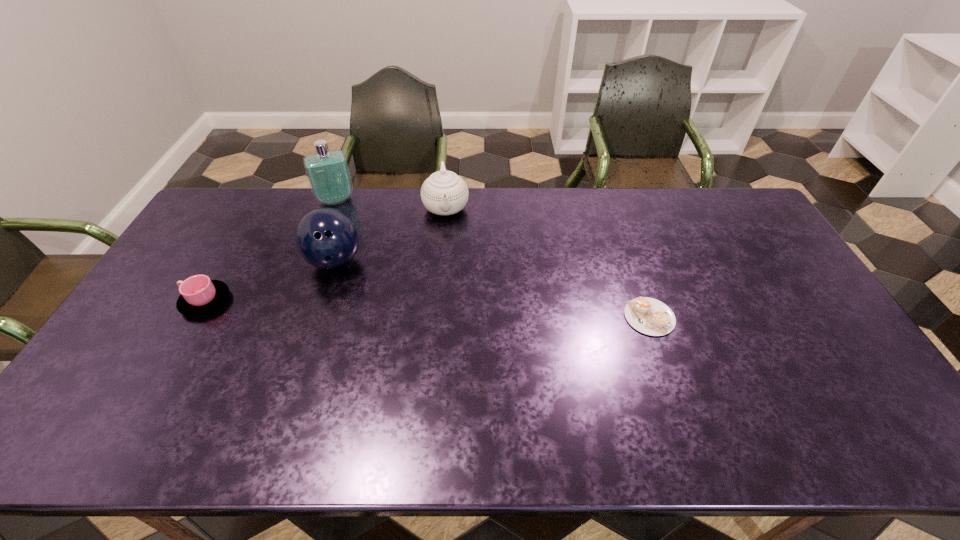
Where is `free region located 0.290m on the surface of the third nearest object near the finger holes`? free region located 0.290m on the surface of the third nearest object near the finger holes is located at coordinates (386, 343).

You are a GUI agent. You are given a task and a screenshot of the screen. Output one action in this format:
    pyautogui.click(x=<x>, y=<y>)
    Task: Click on the free space located on the surface of the third nearest object near the finger holes
    This screenshot has width=960, height=540.
    Given the screenshot: What is the action you would take?
    pyautogui.click(x=366, y=309)

You are a GUI agent. You are given a task and a screenshot of the screen. Output one action in this format:
    pyautogui.click(x=<x>, y=<y>)
    Task: Click on the free spot located on the front label of the tallest object
    The image size is (960, 540).
    Given the screenshot: What is the action you would take?
    pyautogui.click(x=362, y=280)

The width and height of the screenshot is (960, 540). Find the location of `vacant space located on the front label of the tallest object`. vacant space located on the front label of the tallest object is located at coordinates (361, 276).

Where is `vacant space situated 0.150m on the front label of the tallest object`? The image size is (960, 540). vacant space situated 0.150m on the front label of the tallest object is located at coordinates (348, 233).

Identify the location of vacant space located 0.390m on the spout of the chinaware. The image size is (960, 540). (452, 315).

This screenshot has height=540, width=960. I want to click on free region located 0.290m on the spout of the chinaware, so pos(450,289).

You are a GUI agent. You are given a task and a screenshot of the screen. Output one action in this format:
    pyautogui.click(x=<x>, y=<y>)
    Task: Click on the free spot located on the spout of the chinaware
    Image resolution: width=960 pixels, height=540 pixels.
    Given the screenshot: What is the action you would take?
    pyautogui.click(x=449, y=268)

The image size is (960, 540). I want to click on perfume situated at the far edge, so click(328, 174).

Where is `chinaware at the far edge`? The image size is (960, 540). chinaware at the far edge is located at coordinates (443, 193).